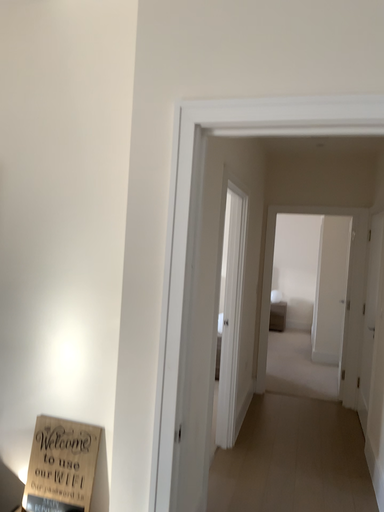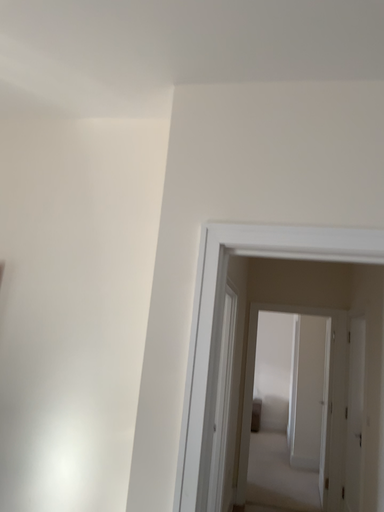
Question: Which way did the camera rotate in the video?

Choices:
 (A) rotated downward
 (B) rotated upward

Answer: (B)